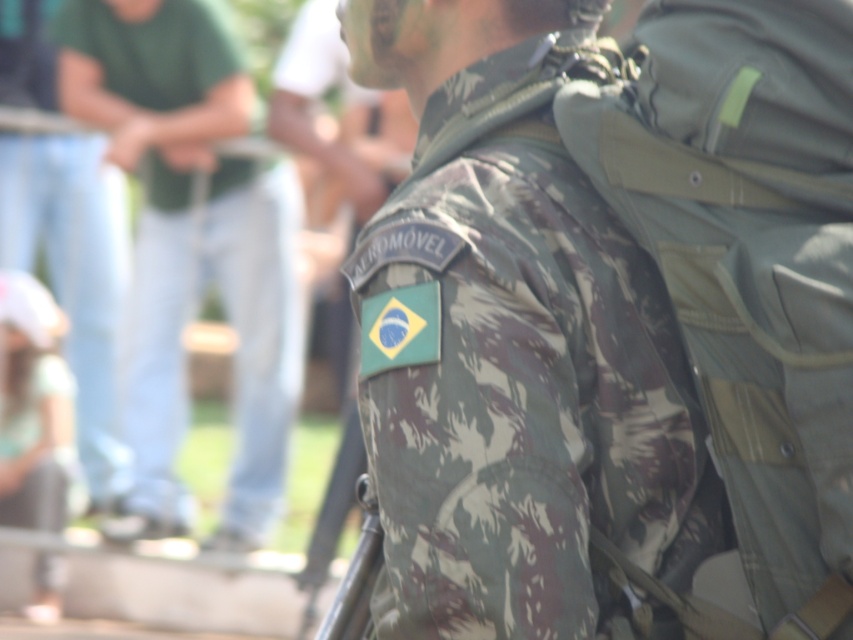
Question: Observing the image, what is the correct spatial positioning of camouflage fabric uniform at center in reference to camouflage fabric uniform at left?

Choices:
 (A) right
 (B) left

Answer: (A)

Question: Which point appears farthest from the camera in this image?

Choices:
 (A) (654, 410)
 (B) (152, 256)

Answer: (B)

Question: Which object is closer to the camera taking this photo?

Choices:
 (A) camouflage fabric uniform at left
 (B) camouflage fabric uniform at center

Answer: (B)

Question: Which of the following is the closest to the observer?

Choices:
 (A) camouflage fabric uniform at center
 (B) camouflage fabric uniform at left

Answer: (A)

Question: Can you confirm if camouflage fabric uniform at center is positioned below camouflage fabric uniform at left?

Choices:
 (A) no
 (B) yes

Answer: (B)

Question: Considering the relative positions of camouflage fabric uniform at center and camouflage fabric uniform at left in the image provided, where is camouflage fabric uniform at center located with respect to camouflage fabric uniform at left?

Choices:
 (A) right
 (B) left

Answer: (A)